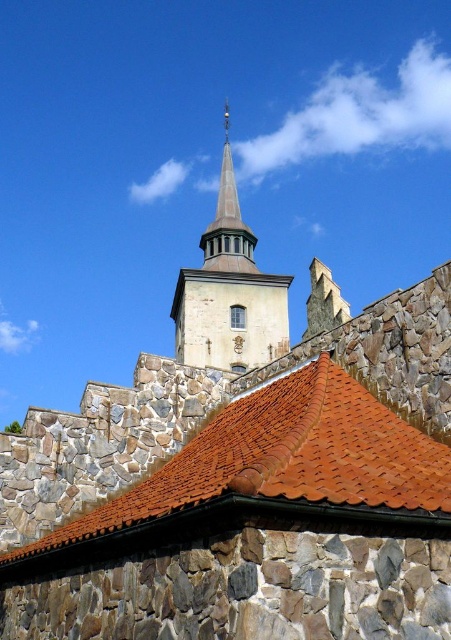
Is point (285, 499) more distant than point (230, 252)?

No, it is in front of (230, 252).

Which is more to the right, brown tile roof at center or smooth stone tower at center?

From the viewer's perspective, brown tile roof at center appears more on the right side.

Where is `brown tile roof at center`? The width and height of the screenshot is (451, 640). brown tile roof at center is located at coordinates (284, 460).

The image size is (451, 640). In order to click on brown tile roof at center in this screenshot , I will do `click(284, 460)`.